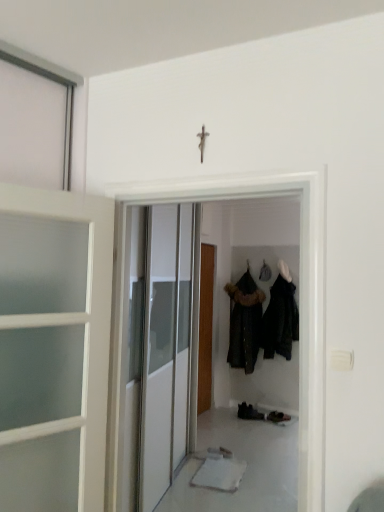
Question: From the image's perspective, is dark fur-trimmed coat at center, acting as the first clothing starting from the left, on white glossy door at center, the second door positioned from the back?

Choices:
 (A) no
 (B) yes

Answer: (A)

Question: Considering the relative positions of dark fur-trimmed coat at center, marked as the 2th clothing in a right-to-left arrangement, and white glossy door at center, the second door positioned from the back, in the image provided, is dark fur-trimmed coat at center, marked as the 2th clothing in a right-to-left arrangement, to the left of white glossy door at center, the second door positioned from the back, from the viewer's perspective?

Choices:
 (A) yes
 (B) no

Answer: (B)

Question: Considering the relative sizes of dark fur-trimmed coat at center, marked as the 2th clothing in a right-to-left arrangement, and white glossy door at center, placed as the first door when sorted from front to back, in the image provided, is dark fur-trimmed coat at center, marked as the 2th clothing in a right-to-left arrangement, smaller than white glossy door at center, placed as the first door when sorted from front to back,?

Choices:
 (A) yes
 (B) no

Answer: (B)

Question: Considering the relative sizes of dark fur-trimmed coat at center, acting as the first clothing starting from the left, and white glossy door at center, placed as the first door when sorted from front to back, in the image provided, is dark fur-trimmed coat at center, acting as the first clothing starting from the left, thinner than white glossy door at center, placed as the first door when sorted from front to back,?

Choices:
 (A) yes
 (B) no

Answer: (B)

Question: From the image's perspective, does dark fur-trimmed coat at center, marked as the 2th clothing in a right-to-left arrangement, appear lower than white glossy door at center, placed as the first door when sorted from front to back?

Choices:
 (A) yes
 (B) no

Answer: (A)

Question: From the image's perspective, is white glossy door at center, placed as the first door when sorted from front to back, positioned above or below dark fur-trimmed coat at center, marked as the 2th clothing in a right-to-left arrangement?

Choices:
 (A) below
 (B) above

Answer: (B)

Question: Is white glossy door at center, the second door positioned from the back, spatially inside dark fur-trimmed coat at center, acting as the first clothing starting from the left, or outside of it?

Choices:
 (A) inside
 (B) outside

Answer: (B)

Question: In terms of width, does white glossy door at center, the second door positioned from the back, look wider or thinner when compared to dark fur-trimmed coat at center, marked as the 2th clothing in a right-to-left arrangement?

Choices:
 (A) wide
 (B) thin

Answer: (B)

Question: Based on their positions, is white glossy door at center, placed as the first door when sorted from front to back, located to the left or right of dark fur-trimmed coat at center, marked as the 2th clothing in a right-to-left arrangement?

Choices:
 (A) right
 (B) left

Answer: (B)

Question: Does point (291, 296) appear closer or farther from the camera than point (246, 404)?

Choices:
 (A) farther
 (B) closer

Answer: (A)

Question: Is dark matte coat at center, which appears as the first clothing when viewed from the right, in front of or behind black leather shoes at lower center in the image?

Choices:
 (A) front
 (B) behind

Answer: (A)

Question: Would you say dark matte coat at center, the second clothing viewed from the left, is inside or outside black leather shoes at lower center?

Choices:
 (A) inside
 (B) outside

Answer: (B)

Question: Based on their sizes in the image, would you say dark matte coat at center, the second clothing viewed from the left, is bigger or smaller than black leather shoes at lower center?

Choices:
 (A) big
 (B) small

Answer: (A)

Question: Looking at their shapes, would you say dark matte coat at center, which appears as the first clothing when viewed from the right, is wider or thinner than white glossy door at center, the second door positioned from the back?

Choices:
 (A) wide
 (B) thin

Answer: (A)

Question: Looking at the image, does dark matte coat at center, which appears as the first clothing when viewed from the right, seem bigger or smaller compared to white glossy door at center, placed as the first door when sorted from front to back?

Choices:
 (A) big
 (B) small

Answer: (A)